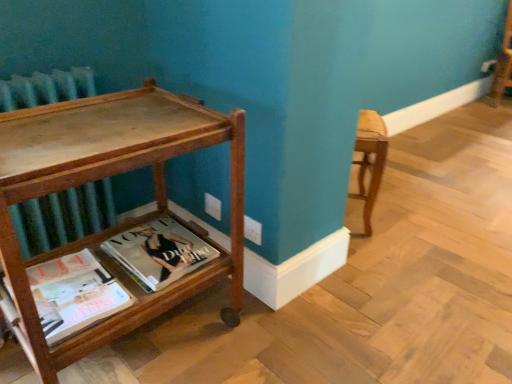
Question: Is matte paper magazine at lower left, the first book when ordered from front to back, in front of or behind matte hardcover book at lower center, which ranks as the first book in back-to-front order, in the image?

Choices:
 (A) behind
 (B) front

Answer: (B)

Question: Considering the positions of point (96, 309) and point (154, 289), is point (96, 309) closer or farther from the camera than point (154, 289)?

Choices:
 (A) closer
 (B) farther

Answer: (A)

Question: Estimate the real-world distances between objects in this image. Which object is closer to the matte hardcover book at lower center, the 2th book in the front-to-back sequence?

Choices:
 (A) wooden table at left
 (B) matte paper magazine at lower left, the first book when ordered from front to back

Answer: (B)

Question: Which object is the closest to the matte paper magazine at lower left, the first book when ordered from front to back?

Choices:
 (A) matte hardcover book at lower center, the 2th book in the front-to-back sequence
 (B) wooden table at left

Answer: (A)